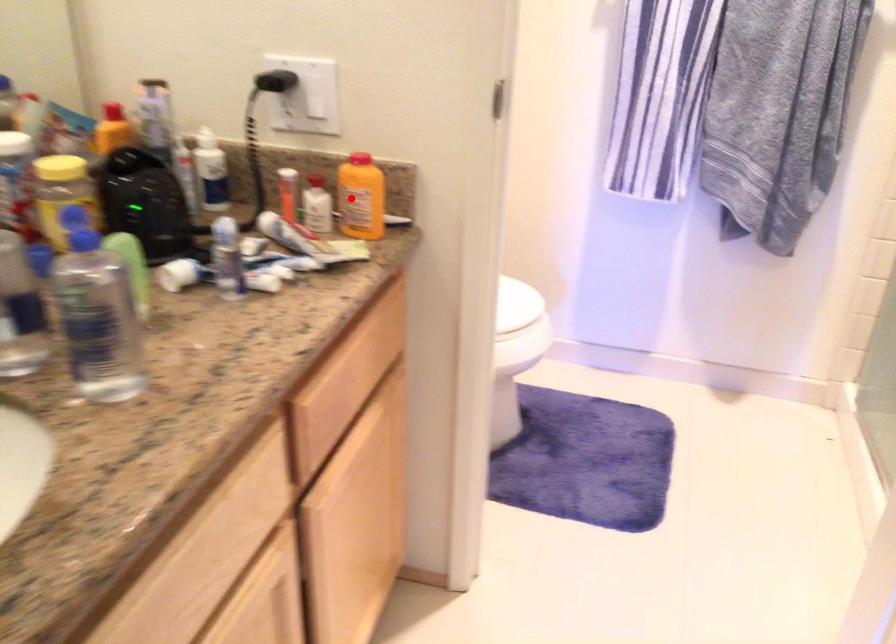
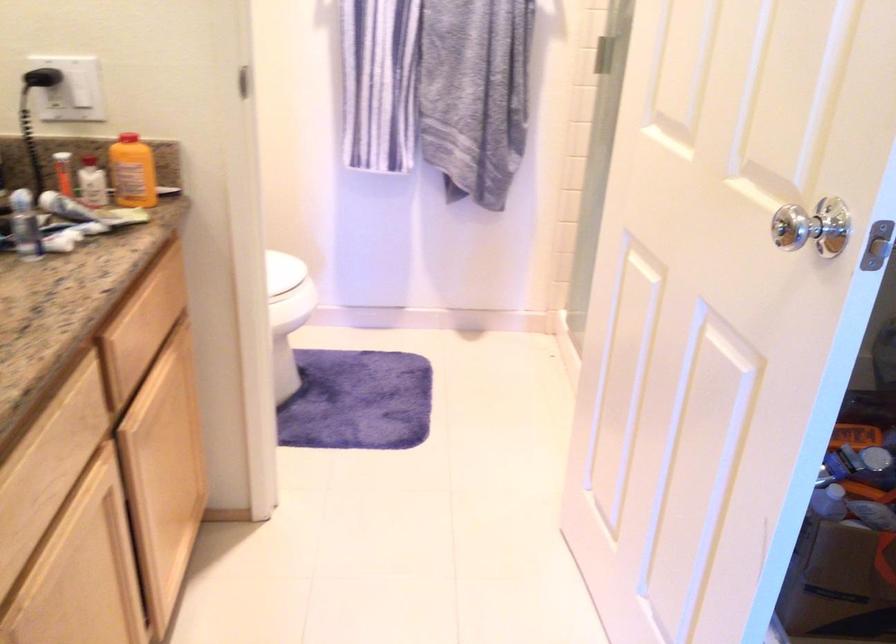
Question: I am providing you with two images of the same scene from different viewpoints. Given a red point in image1, look at the same physical point in image2. Is it:

Choices:
 (A) Closer to the viewpoint
 (B) Farther from the viewpoint

Answer: (B)